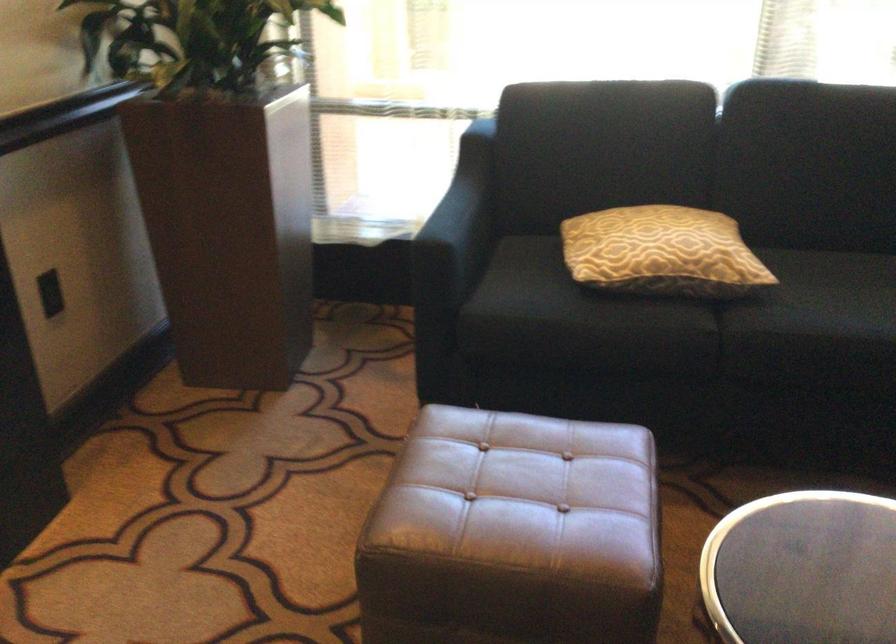
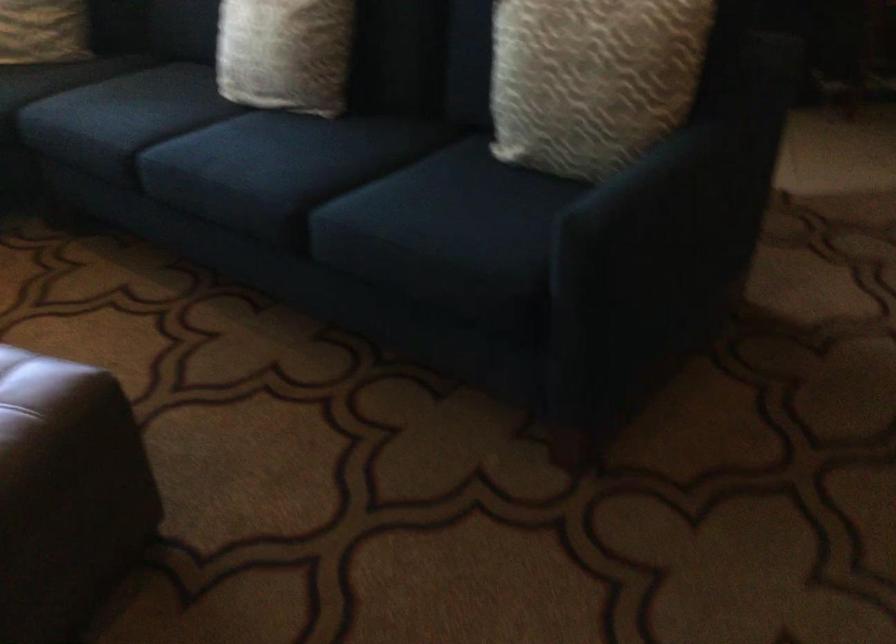
Based on the continuous images, in which direction is the camera rotating?

The rotation direction of the camera is right-down.